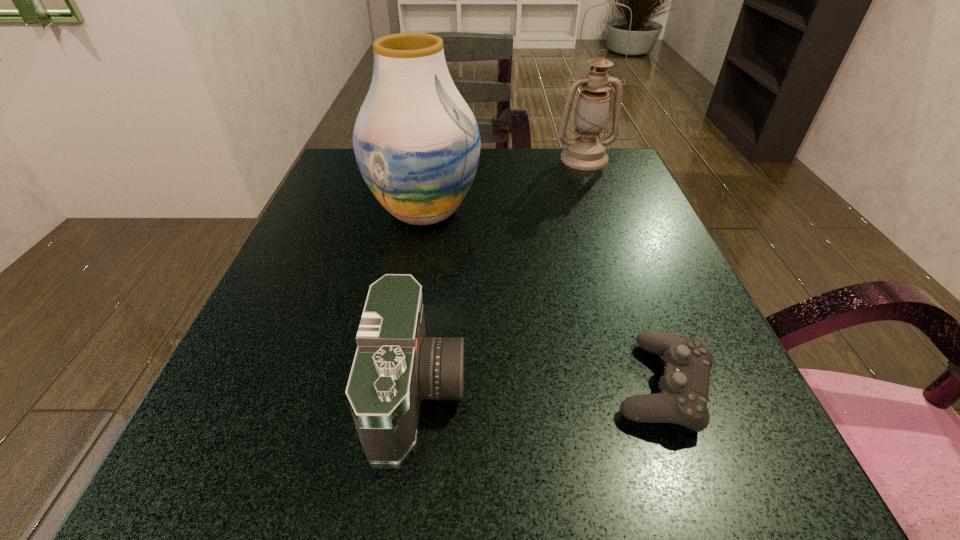
The height and width of the screenshot is (540, 960). What are the coordinates of `object that is the third closest one to the vase` in the screenshot? It's located at (684, 386).

At what (x,y) coordinates should I click in order to perform the action: click on object that is the second nearest to the camera. Please return your answer as a coordinate pair (x, y). Looking at the image, I should click on (417, 144).

Identify the location of vacant area that satisfies the following two spatial constraints: 1. on the back side of the vase; 2. on the left side of the farthest object. (433, 159).

Locate an element on the screen. This screenshot has width=960, height=540. free point that satisfies the following two spatial constraints: 1. on the front side of the control; 2. on the front-facing side of the camera is located at coordinates (664, 390).

This screenshot has width=960, height=540. What are the coordinates of `vacant point that satisfies the following two spatial constraints: 1. on the front side of the oil lamp; 2. on the front-facing side of the third tallest object` in the screenshot? It's located at (670, 390).